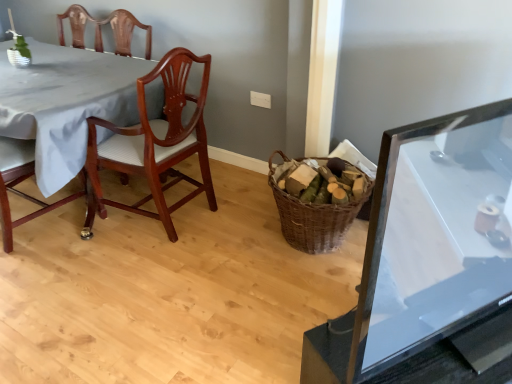
Question: Looking at the image, does mahogany wood chair at left, the second chair in the right-to-left sequence, seem bigger or smaller compared to transparent glass table at right, which ranks as the 2th table in left-to-right order?

Choices:
 (A) big
 (B) small

Answer: (A)

Question: Is mahogany wood chair at left, the second chair in the right-to-left sequence, to the left or to the right of transparent glass table at right, which is counted as the 2th table, starting from the back, in the image?

Choices:
 (A) right
 (B) left

Answer: (B)

Question: Which object is the closest to the mahogany wood chair at left, which is the 2th chair in left-to-right order?

Choices:
 (A) woven brown basket at center
 (B) white fabric table at left, the 2th table from the front
 (C) mahogany wood chair at left, which is counted as the 1th chair, starting from the left
 (D) transparent glass table at right, the first table in the front-to-back sequence

Answer: (B)

Question: Estimate the real-world distances between objects in this image. Which object is closer to the transparent glass table at right, placed as the first table when sorted from right to left?

Choices:
 (A) woven brown basket at center
 (B) mahogany wood chair at left, which ranks as the 1th chair in right-to-left order
 (C) white fabric table at left, positioned as the first table in left-to-right order
 (D) mahogany wood chair at left, which is counted as the 1th chair, starting from the left

Answer: (A)